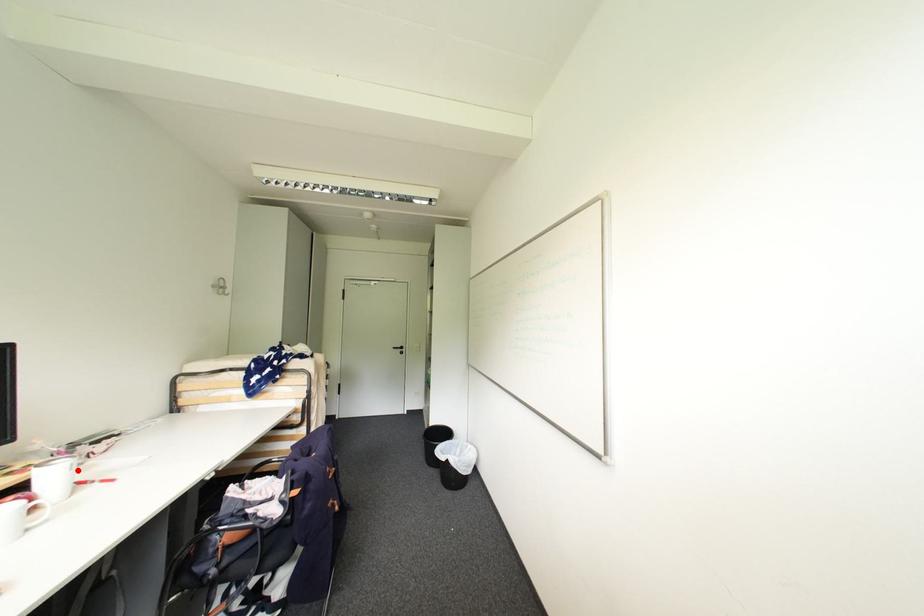
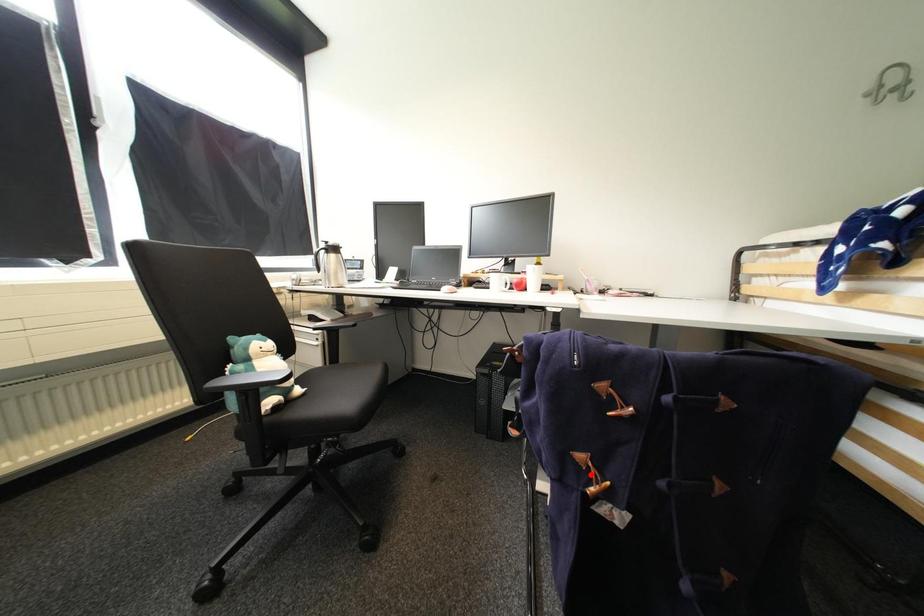
I am providing you with two images of the same scene from different viewpoints. A red point is marked on the first image and another point is marked on the second image. Do the highlighted points in image1 and image2 indicate the same real-world spot?

No